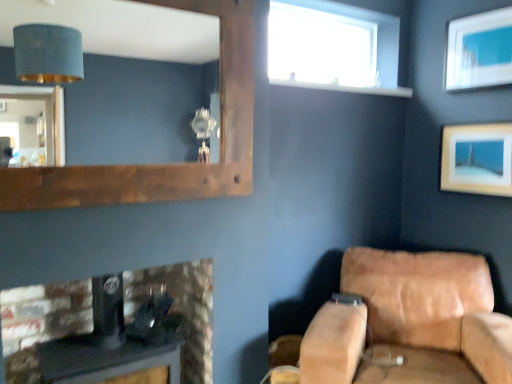
Question: Can you confirm if wooden picture frame at upper right, which is the 1th picture frame from bottom to top, is smaller than matte white picture frame at upper right, arranged as the 2th picture frame when ordered from the bottom?

Choices:
 (A) yes
 (B) no

Answer: (B)

Question: From a real-world perspective, is wooden picture frame at upper right, the 2th picture frame from the top, located beneath matte white picture frame at upper right, which is the 1th picture frame in top-to-bottom order?

Choices:
 (A) no
 (B) yes

Answer: (B)

Question: Does wooden picture frame at upper right, which is the 1th picture frame from bottom to top, appear on the left side of matte white picture frame at upper right, arranged as the 2th picture frame when ordered from the bottom?

Choices:
 (A) no
 (B) yes

Answer: (B)

Question: Is wooden picture frame at upper right, which is the 1th picture frame from bottom to top, further to the viewer compared to matte white picture frame at upper right, arranged as the 2th picture frame when ordered from the bottom?

Choices:
 (A) yes
 (B) no

Answer: (A)

Question: Considering the relative sizes of wooden picture frame at upper right, the 2th picture frame from the top, and matte white picture frame at upper right, arranged as the 2th picture frame when ordered from the bottom, in the image provided, is wooden picture frame at upper right, the 2th picture frame from the top, bigger than matte white picture frame at upper right, arranged as the 2th picture frame when ordered from the bottom,?

Choices:
 (A) yes
 (B) no

Answer: (A)

Question: Is wooden picture frame at upper right, the 2th picture frame from the top, turned away from matte white picture frame at upper right, arranged as the 2th picture frame when ordered from the bottom?

Choices:
 (A) no
 (B) yes

Answer: (A)

Question: Considering the relative positions of brown wooden mirror at upper left and wooden picture frame at upper right, the 2th picture frame from the top, in the image provided, is brown wooden mirror at upper left to the left of wooden picture frame at upper right, the 2th picture frame from the top, from the viewer's perspective?

Choices:
 (A) yes
 (B) no

Answer: (A)

Question: Considering the relative sizes of brown wooden mirror at upper left and wooden picture frame at upper right, which is the 1th picture frame from bottom to top, in the image provided, is brown wooden mirror at upper left shorter than wooden picture frame at upper right, which is the 1th picture frame from bottom to top,?

Choices:
 (A) no
 (B) yes

Answer: (A)

Question: From a real-world perspective, is brown wooden mirror at upper left physically above wooden picture frame at upper right, which is the 1th picture frame from bottom to top?

Choices:
 (A) no
 (B) yes

Answer: (B)

Question: Is brown wooden mirror at upper left further to the viewer compared to wooden picture frame at upper right, the 2th picture frame from the top?

Choices:
 (A) yes
 (B) no

Answer: (B)

Question: Can you confirm if brown wooden mirror at upper left is thinner than wooden picture frame at upper right, the 2th picture frame from the top?

Choices:
 (A) no
 (B) yes

Answer: (B)

Question: From the image's perspective, is brown wooden mirror at upper left above wooden picture frame at upper right, the 2th picture frame from the top?

Choices:
 (A) no
 (B) yes

Answer: (B)

Question: From the image's perspective, does transparent glass window at upper center appear lower than black leather speaker at lower left?

Choices:
 (A) no
 (B) yes

Answer: (A)